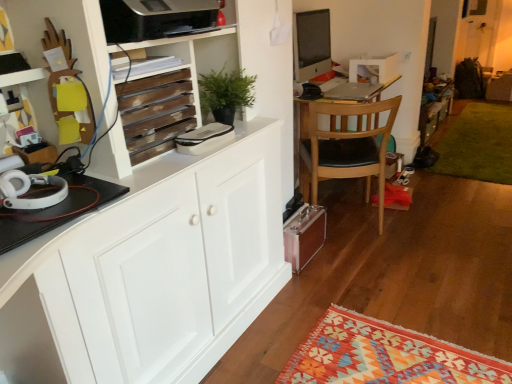
Question: Considering the positions of point (325, 132) and point (167, 72), is point (325, 132) closer or farther from the camera than point (167, 72)?

Choices:
 (A) closer
 (B) farther

Answer: (B)

Question: From the image's perspective, is light brown wood chair at center above or below wooden slats at upper left?

Choices:
 (A) above
 (B) below

Answer: (B)

Question: Which is farther from the silver metallic laptop at center?

Choices:
 (A) light brown wood chair at center
 (B) satin black monitor at upper center
 (C) wooden slats at upper left

Answer: (C)

Question: Which is farther from the satin black monitor at upper center?

Choices:
 (A) light brown wood chair at center
 (B) silver metallic laptop at center
 (C) wooden slats at upper left

Answer: (C)